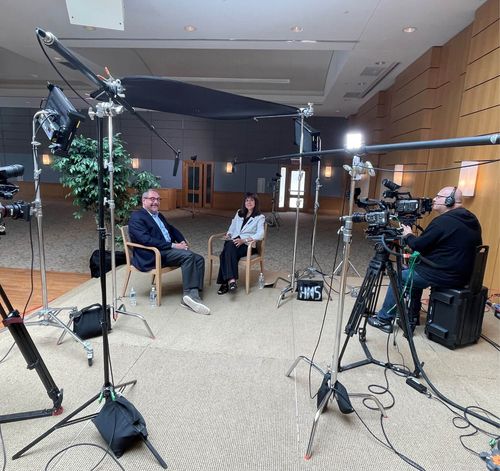
Find the location of a particular element. This screenshot has width=500, height=471. light coming through door is located at coordinates (292, 177).